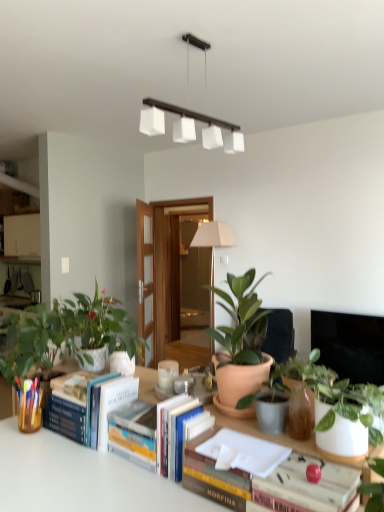
Question: Considering the relative positions of white glossy pot at center, the second houseplant viewed from the left, and green matte plant at left, positioned as the 1th houseplant in left-to-right order, in the image provided, is white glossy pot at center, the second houseplant viewed from the left, behind green matte plant at left, positioned as the 1th houseplant in left-to-right order,?

Choices:
 (A) no
 (B) yes

Answer: (B)

Question: Is green matte plant at left, the fifth houseplant positioned from the right, located within white glossy pot at center, the fourth houseplant in the right-to-left sequence?

Choices:
 (A) yes
 (B) no

Answer: (B)

Question: From a real-world perspective, is white glossy pot at center, the fourth houseplant in the right-to-left sequence, physically above green matte plant at left, positioned as the 1th houseplant in left-to-right order?

Choices:
 (A) yes
 (B) no

Answer: (A)

Question: Does white glossy pot at center, the fourth houseplant in the right-to-left sequence, touch green matte plant at left, the fifth houseplant positioned from the right?

Choices:
 (A) yes
 (B) no

Answer: (A)

Question: Does white glossy pot at center, the fourth houseplant in the right-to-left sequence, have a greater width compared to green matte plant at left, the fifth houseplant positioned from the right?

Choices:
 (A) yes
 (B) no

Answer: (B)

Question: In the image, is hardcover book at center, which is the 1th paperback book in left-to-right order, on the left side or the right side of green matte plant at left, positioned as the 1th houseplant in left-to-right order?

Choices:
 (A) left
 (B) right

Answer: (B)

Question: From a real-world perspective, is hardcover book at center, which appears as the 2th paperback book when viewed from the front, above or below green matte plant at left, positioned as the 1th houseplant in left-to-right order?

Choices:
 (A) above
 (B) below

Answer: (B)

Question: Would you say hardcover book at center, arranged as the 2th paperback book when viewed from the right, is inside or outside green matte plant at left, the fifth houseplant positioned from the right?

Choices:
 (A) inside
 (B) outside

Answer: (B)

Question: Is hardcover book at center, which appears as the 2th paperback book when viewed from the front, wider or thinner than green matte plant at left, the fifth houseplant positioned from the right?

Choices:
 (A) wide
 (B) thin

Answer: (B)

Question: From a real-world perspective, is white glossy pot at center, the fourth houseplant in the right-to-left sequence, positioned above or below hardcover book at center, which is the 1th paperback book in left-to-right order?

Choices:
 (A) above
 (B) below

Answer: (A)

Question: Relative to hardcover book at center, which is the 1th paperback book in left-to-right order, is white glossy pot at center, the fourth houseplant in the right-to-left sequence, in front or behind?

Choices:
 (A) behind
 (B) front

Answer: (A)

Question: In the image, is white glossy pot at center, the fourth houseplant in the right-to-left sequence, on the left side or the right side of hardcover book at center, arranged as the 2th paperback book when viewed from the right?

Choices:
 (A) left
 (B) right

Answer: (A)

Question: Looking at their shapes, would you say white glossy pot at center, the fourth houseplant in the right-to-left sequence, is wider or thinner than hardcover book at center, which appears as the 2th paperback book when viewed from the front?

Choices:
 (A) thin
 (B) wide

Answer: (B)

Question: Is terracotta pot at center, placed as the second houseplant when sorted from right to left, inside the boundaries of white matte rectangular light fixture at upper center, or outside?

Choices:
 (A) inside
 (B) outside

Answer: (B)

Question: Based on their positions, is terracotta pot at center, placed as the second houseplant when sorted from right to left, located to the left or right of white matte rectangular light fixture at upper center?

Choices:
 (A) right
 (B) left

Answer: (A)